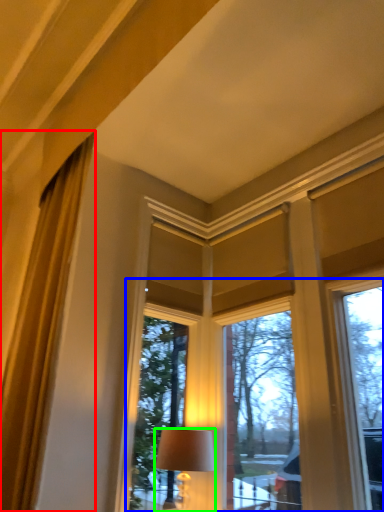
Question: Estimate the real-world distances between objects in this image. Which object is closer to curtain (highlighted by a red box), bay window (highlighted by a blue box) or lamp (highlighted by a green box)?

Choices:
 (A) bay window
 (B) lamp

Answer: (B)